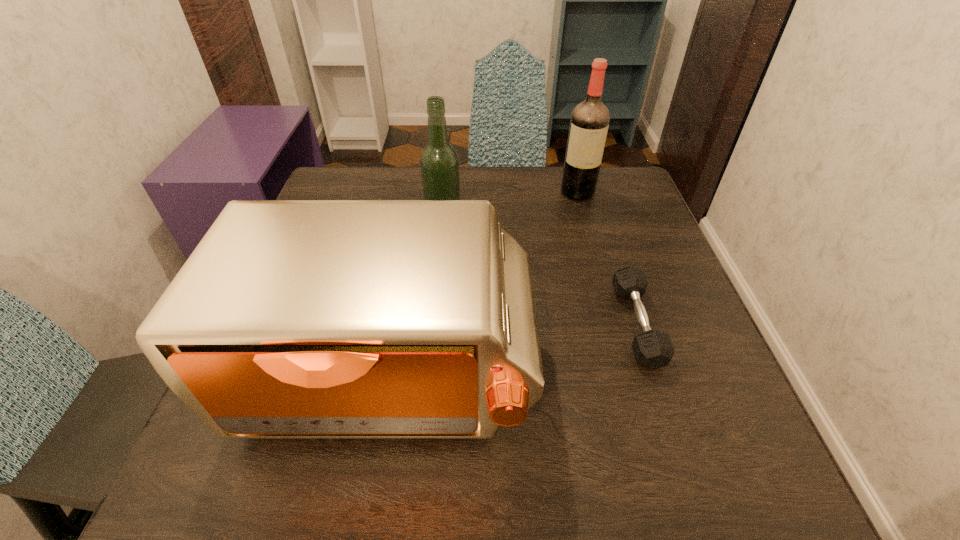
Where is `vacant area at the far right corner`? vacant area at the far right corner is located at coordinates (620, 188).

In the image, there is a desktop. Where is `vacant area at the near right corner`? vacant area at the near right corner is located at coordinates (714, 480).

Identify the location of empty space between the left liquor and the farthest object. (511, 210).

The image size is (960, 540). I want to click on vacant point located between the farther liquor and the dumbbell, so click(x=607, y=258).

Identify the location of free space that is in between the farther liquor and the second farthest object. (511, 210).

Where is `free spot between the dumbbell and the second farthest object`? The width and height of the screenshot is (960, 540). free spot between the dumbbell and the second farthest object is located at coordinates (540, 275).

You are a GUI agent. You are given a task and a screenshot of the screen. Output one action in this format:
    pyautogui.click(x=<x>, y=<y>)
    Task: Click on the vacant space in between the farther liquor and the dumbbell
    
    Given the screenshot: What is the action you would take?
    pyautogui.click(x=607, y=258)

Locate an element on the screen. vacant space that is in between the farther liquor and the shortest object is located at coordinates (607, 258).

Locate an element on the screen. This screenshot has height=540, width=960. the closest object relative to the nearer liquor is located at coordinates (292, 319).

The image size is (960, 540). What are the coordinates of `the closest object to the farthest object` in the screenshot? It's located at (439, 162).